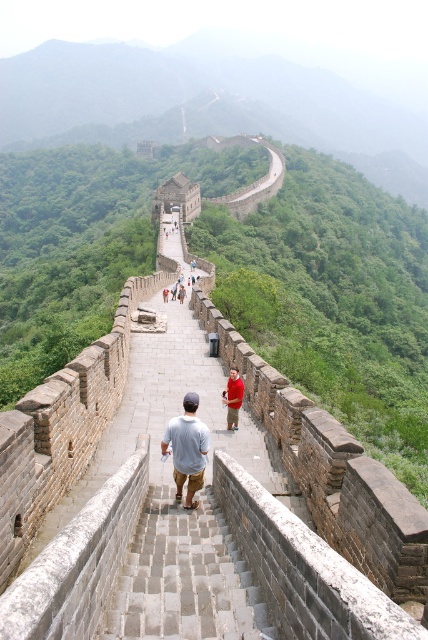
You are standing on the Great Wall of China and want to take a photo of two specific points on the wall. The first point is at coordinates point (204,460) and the second point is at point (228,394). Which point will appear larger in your camera view?

Point (204,460) is closer to the camera than point (228,394), so it will appear larger in the camera view.

Based on the photo, you are a tour guide leading a group on the Great Wall. Two tourists are standing at the center of the path, wearing a light blue cotton shirt and a red cotton shirt respectively. You need to ensure they stay within the safe zone marked by the low stone walls on both sides. Can you confirm if the distance between the light blue cotton shirt at center and the red cotton shirt at center allows them to remain within the safe zone?

The distance between the light blue cotton shirt at center and the red cotton shirt at center is 7.77 meters. Since the path is flanked by low stone walls on both sides, the tourists are within the safe zone as long as they stay on the pathway between the walls. The distance between them does not affect their position relative to the walls.

You are standing at the base of the Great Wall and want to take a photo of the light blue cotton shirt at center. Your camera is 21.31 meters away from the shirt. Is the camera within the maximum range of 25 meters for clear photos?

The camera is 21.31 meters away from the light blue cotton shirt at center, which is within the 25 meters maximum range for clear photos. Therefore, the camera is within range.